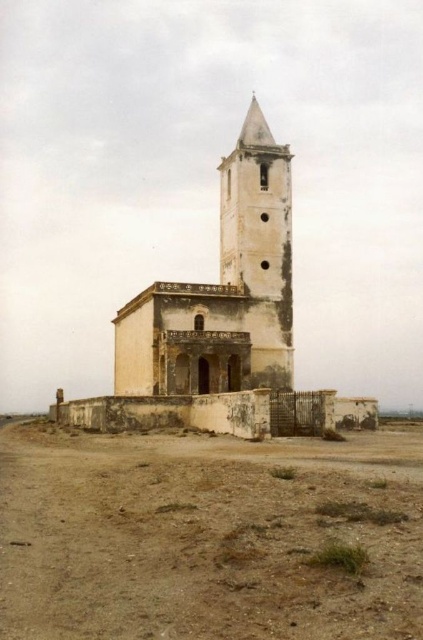
Question: Estimate the real-world distances between objects in this image. Which object is closer to the white weathered church at center?

Choices:
 (A) brown sandy dirt field at lower left
 (B) smooth beige stone bell tower at center

Answer: (B)

Question: Which object appears closest to the camera in this image?

Choices:
 (A) brown sandy dirt field at lower left
 (B) smooth beige stone bell tower at center

Answer: (A)

Question: Which of the following is the farthest from the observer?

Choices:
 (A) smooth beige stone bell tower at center
 (B) brown sandy dirt field at lower left
 (C) white weathered church at center

Answer: (A)

Question: Is white weathered church at center positioned behind smooth beige stone bell tower at center?

Choices:
 (A) yes
 (B) no

Answer: (B)

Question: Is brown sandy dirt field at lower left positioned in front of smooth beige stone bell tower at center?

Choices:
 (A) yes
 (B) no

Answer: (A)

Question: Considering the relative positions of white weathered church at center and smooth beige stone bell tower at center in the image provided, where is white weathered church at center located with respect to smooth beige stone bell tower at center?

Choices:
 (A) below
 (B) above

Answer: (A)